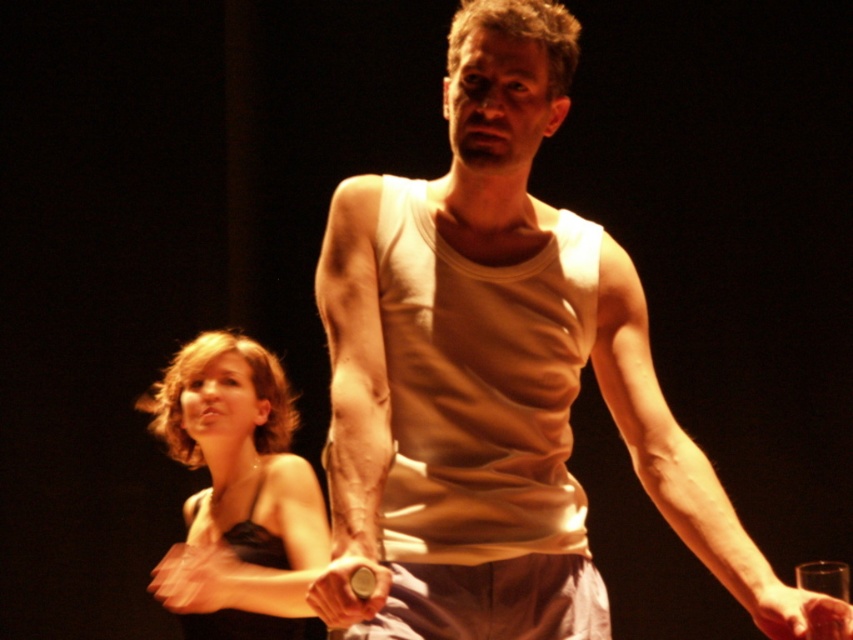
Measure the distance from white cotton tank top at center to satin black dress at lower left.

white cotton tank top at center is 1.04 meters from satin black dress at lower left.

You are a GUI agent. You are given a task and a screenshot of the screen. Output one action in this format:
    pyautogui.click(x=<x>, y=<y>)
    Task: Click on the white cotton tank top at center
    
    Given the screenshot: What is the action you would take?
    pyautogui.click(x=492, y=365)

Can you confirm if white cotton tank top at center is shorter than smooth skin hand at lower right?

In fact, white cotton tank top at center may be taller than smooth skin hand at lower right.

Is white cotton tank top at center to the right of smooth skin hand at lower right from the viewer's perspective?

Incorrect, white cotton tank top at center is not on the right side of smooth skin hand at lower right.

Is point (527, 52) positioned in front of point (799, 627)?

No, it is not.

The image size is (853, 640). In order to click on white cotton tank top at center in this screenshot , I will do `click(492, 365)`.

Can you confirm if white cotton tank top at center is positioned above matte brown stick at center?

Indeed, white cotton tank top at center is positioned over matte brown stick at center.

Is white cotton tank top at center to the right of matte brown stick at center from the viewer's perspective?

Indeed, white cotton tank top at center is positioned on the right side of matte brown stick at center.

Identify the location of white cotton tank top at center. The width and height of the screenshot is (853, 640). (492, 365).